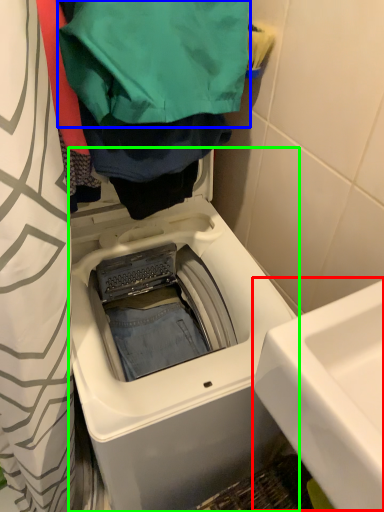
Question: Which object is the closest to the sink (highlighted by a red box)? Choose among these: clothing (highlighted by a blue box) or washing machine (highlighted by a green box).

Choices:
 (A) clothing
 (B) washing machine

Answer: (B)